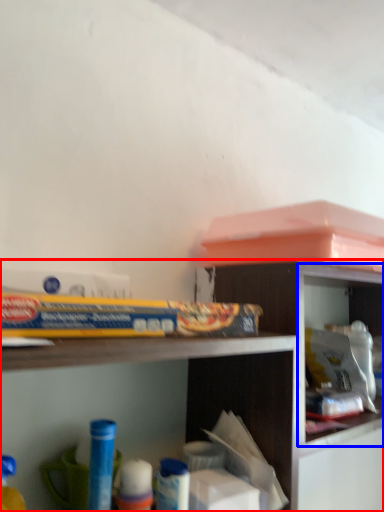
Question: Which of the following is the closest to the observer, shelf (highlighted by a red box) or cabinet (highlighted by a blue box)?

Choices:
 (A) shelf
 (B) cabinet

Answer: (A)